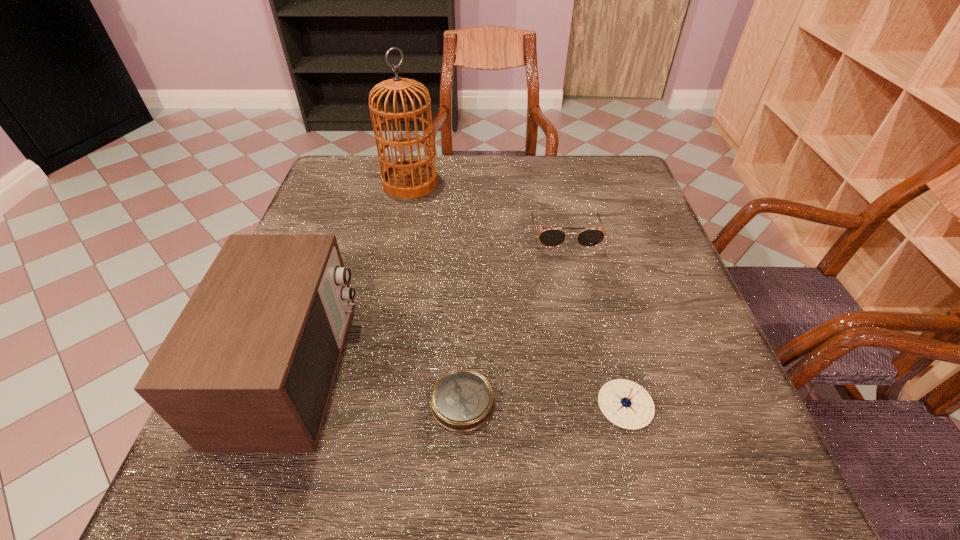
The width and height of the screenshot is (960, 540). In order to click on vacant region between the left compass and the second farthest object in this screenshot , I will do `click(514, 319)`.

Where is `empty space that is in between the tallest object and the third tallest object`? Image resolution: width=960 pixels, height=540 pixels. empty space that is in between the tallest object and the third tallest object is located at coordinates (488, 209).

You are a GUI agent. You are given a task and a screenshot of the screen. Output one action in this format:
    pyautogui.click(x=<x>, y=<y>)
    Task: Click on the free spot between the taller compass and the birdcage
    
    Given the screenshot: What is the action you would take?
    pyautogui.click(x=517, y=294)

Where is `vacant area between the birdcage and the fourth shortest object`? This screenshot has width=960, height=540. vacant area between the birdcage and the fourth shortest object is located at coordinates (351, 275).

Point out which object is positioned as the nearest to the tallest object. Please provide its 2D coordinates. Your answer should be formatted as a tuple, i.e. [(x, y)], where the tuple contains the x and y coordinates of a point satisfying the conditions above.

[(551, 237)]

Where is `object that is the nearest to the radio receiver`? The width and height of the screenshot is (960, 540). object that is the nearest to the radio receiver is located at coordinates (462, 400).

The image size is (960, 540). I want to click on free space that satisfies the following two spatial constraints: 1. on the front side of the tallest object; 2. on the right side of the right compass, so click(366, 404).

This screenshot has height=540, width=960. Find the location of `vacant space that satisfies the following two spatial constraints: 1. on the back side of the shorter compass; 2. on the front-facing side of the radio receiver`. vacant space that satisfies the following two spatial constraints: 1. on the back side of the shorter compass; 2. on the front-facing side of the radio receiver is located at coordinates (464, 369).

I want to click on vacant area in the image that satisfies the following two spatial constraints: 1. on the front side of the tallest object; 2. on the front-facing side of the radio receiver, so click(x=372, y=369).

I want to click on free space in the image that satisfies the following two spatial constraints: 1. on the front lenses of the sunglasses; 2. on the front-facing side of the radio receiver, so click(592, 369).